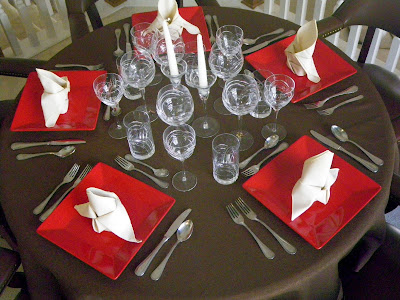
Where is `candles and candlestick holders`? Image resolution: width=400 pixels, height=300 pixels. candles and candlestick holders is located at coordinates (171, 51), (200, 56), (205, 91), (176, 81).